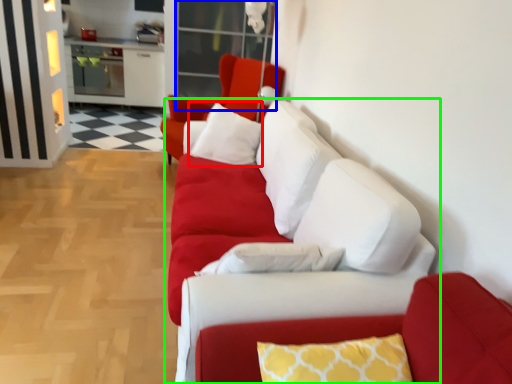
Question: Estimate the real-world distances between objects in this image. Which object is farther from pillow (highlighted by a red box), glass door (highlighted by a blue box) or studio couch (highlighted by a green box)?

Choices:
 (A) glass door
 (B) studio couch

Answer: (A)